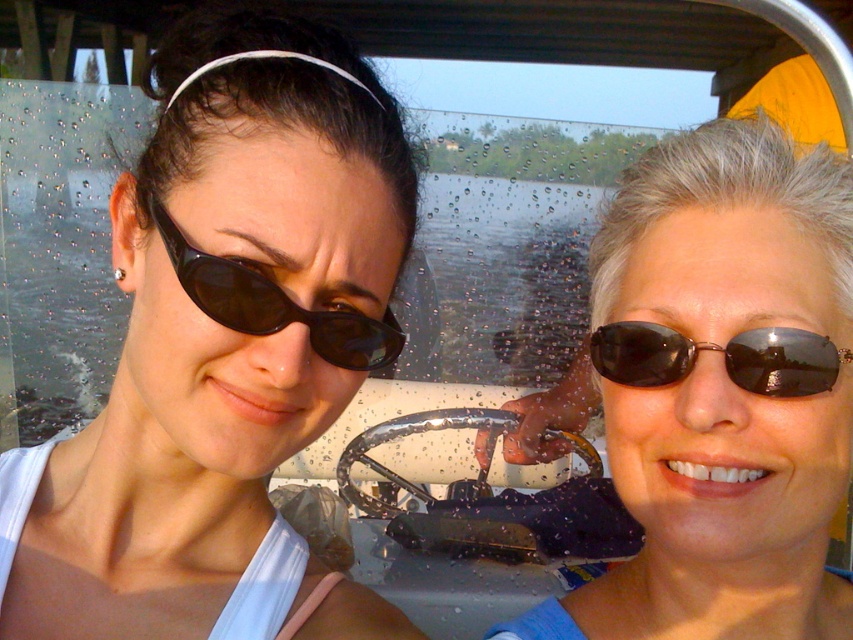
You are a photographer trying to capture the reflection of the sunglasses in the wet window. Which sunglasses, the shiny black sunglasses at center or the black matte sunglasses at left, would you expect to have a clearer reflection?

The shiny black sunglasses at center would have a clearer reflection because shiny surfaces typically reflect more clearly than matte surfaces.

You are a photographer trying to capture a closeup shot of the shiny black sunglasses at center. The camera you are using has a minimum focusing distance of 24 inches. Will you be able to take the photo without moving the camera closer?

The distance between the shiny black sunglasses at center and the camera is 24.57 inches, which is slightly beyond the minimum focusing distance of 24 inches. Therefore, you will not be able to take a clear closeup shot without moving the camera closer.